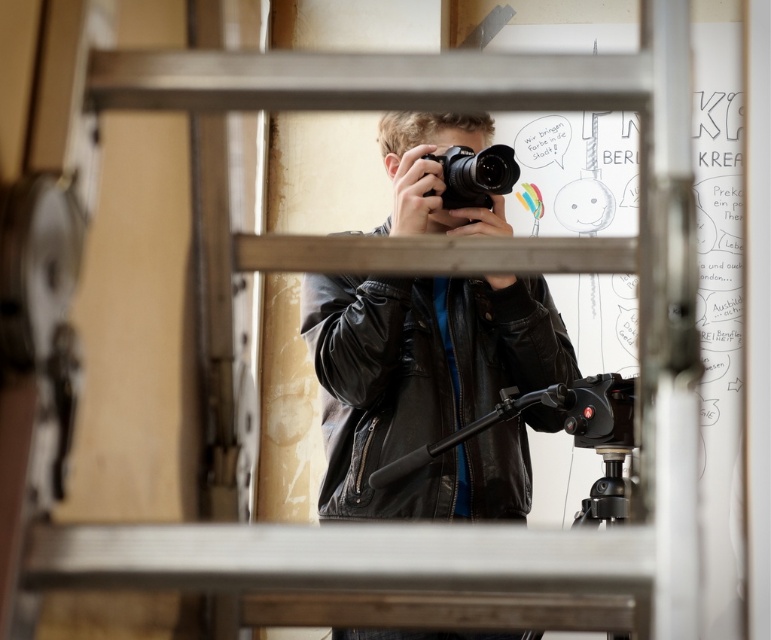
Between black leather jacket at center and black matte tripod at center, which one appears on the right side from the viewer's perspective?

black matte tripod at center

Is black leather jacket at center positioned behind black matte tripod at center?

Yes, black leather jacket at center is behind black matte tripod at center.

Between point (443, 346) and point (621, 456), which one is positioned in front?

Point (621, 456) is in front.

This screenshot has width=771, height=640. In order to click on black leather jacket at center in this screenshot , I will do `click(429, 388)`.

Does black matte tripod at center come in front of black matte camera at center?

That is True.

Who is positioned more to the right, black matte tripod at center or black matte camera at center?

Positioned to the right is black matte tripod at center.

You are a GUI agent. You are given a task and a screenshot of the screen. Output one action in this format:
    pyautogui.click(x=<x>, y=<y>)
    Task: Click on the black matte tripod at center
    This screenshot has width=771, height=640.
    Given the screenshot: What is the action you would take?
    pyautogui.click(x=564, y=429)

Does black leather jacket at center have a greater width compared to black matte camera at center?

Yes.

Is black leather jacket at center above black matte camera at center?

Actually, black leather jacket at center is below black matte camera at center.

Where is `black leather jacket at center`? This screenshot has height=640, width=771. black leather jacket at center is located at coordinates (429, 388).